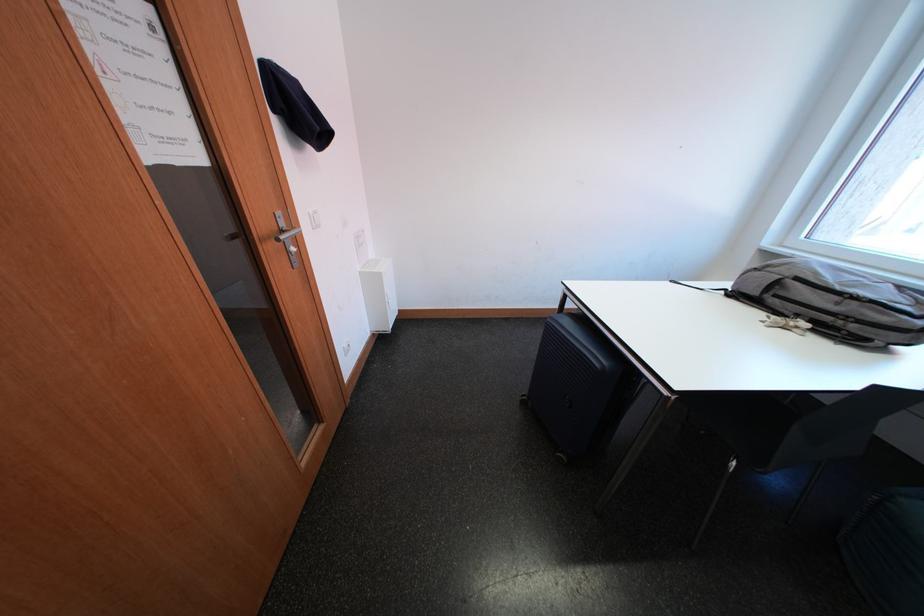
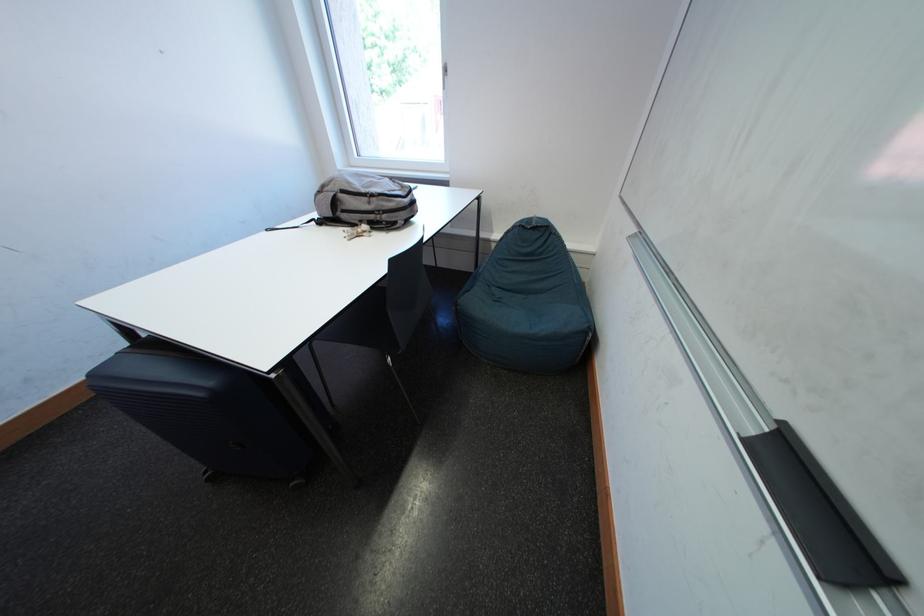
First-person continuous shooting, in which direction is the camera rotating?

The camera rotated toward right-down.